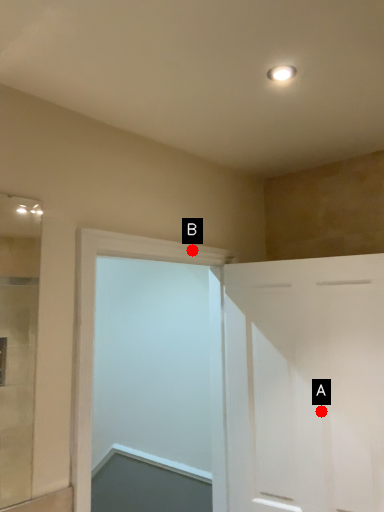
Question: Two points are circled on the image, labeled by A and B beside each circle. Which point is farther from the camera taking this photo?

Choices:
 (A) A is further
 (B) B is further

Answer: (B)